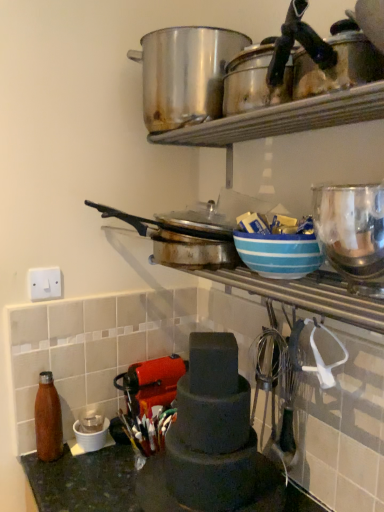
Question: From a real-world perspective, does blue striped bowl at upper center sit lower than dark green stone countertop at lower left?

Choices:
 (A) no
 (B) yes

Answer: (A)

Question: Is blue striped bowl at upper center further to the viewer compared to dark green stone countertop at lower left?

Choices:
 (A) no
 (B) yes

Answer: (A)

Question: Can you confirm if blue striped bowl at upper center is smaller than dark green stone countertop at lower left?

Choices:
 (A) no
 (B) yes

Answer: (B)

Question: From the image's perspective, is blue striped bowl at upper center above dark green stone countertop at lower left?

Choices:
 (A) yes
 (B) no

Answer: (A)

Question: From a real-world perspective, is blue striped bowl at upper center on dark green stone countertop at lower left?

Choices:
 (A) yes
 (B) no

Answer: (A)

Question: Does point (162, 86) appear closer or farther from the camera than point (243, 242)?

Choices:
 (A) farther
 (B) closer

Answer: (A)

Question: From a real-world perspective, is stainless steel pot at upper center positioned above or below blue striped bowl at upper center?

Choices:
 (A) above
 (B) below

Answer: (A)

Question: Based on their positions, is stainless steel pot at upper center located to the left or right of blue striped bowl at upper center?

Choices:
 (A) right
 (B) left

Answer: (B)

Question: Is stainless steel pot at upper center spatially inside blue striped bowl at upper center, or outside of it?

Choices:
 (A) inside
 (B) outside

Answer: (B)

Question: Is matte black tiered cake stand at center, arranged as the second appliance when viewed from the front, bigger or smaller than dark green stone countertop at lower left?

Choices:
 (A) big
 (B) small

Answer: (B)

Question: From a real-world perspective, is matte black tiered cake stand at center, the second appliance from the top, physically located above or below dark green stone countertop at lower left?

Choices:
 (A) above
 (B) below

Answer: (A)

Question: From the image's perspective, is matte black tiered cake stand at center, placed as the first appliance when sorted from bottom to top, above or below dark green stone countertop at lower left?

Choices:
 (A) below
 (B) above

Answer: (B)

Question: Choose the correct answer: Is matte black tiered cake stand at center, the second appliance from the top, inside dark green stone countertop at lower left or outside it?

Choices:
 (A) inside
 (B) outside

Answer: (B)

Question: Looking at their shapes, would you say white plastic switch at upper left is wider or thinner than dark green stone countertop at lower left?

Choices:
 (A) wide
 (B) thin

Answer: (B)

Question: Considering the relative positions of white plastic switch at upper left and dark green stone countertop at lower left in the image provided, is white plastic switch at upper left to the left or to the right of dark green stone countertop at lower left?

Choices:
 (A) right
 (B) left

Answer: (B)